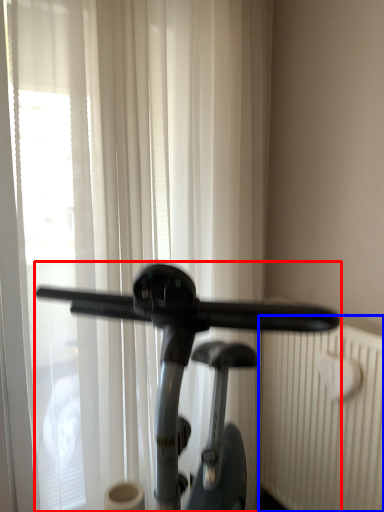
Question: Which object appears farthest to the camera in this image, stationary bicycle (highlighted by a red box) or radiator (highlighted by a blue box)?

Choices:
 (A) stationary bicycle
 (B) radiator

Answer: (B)